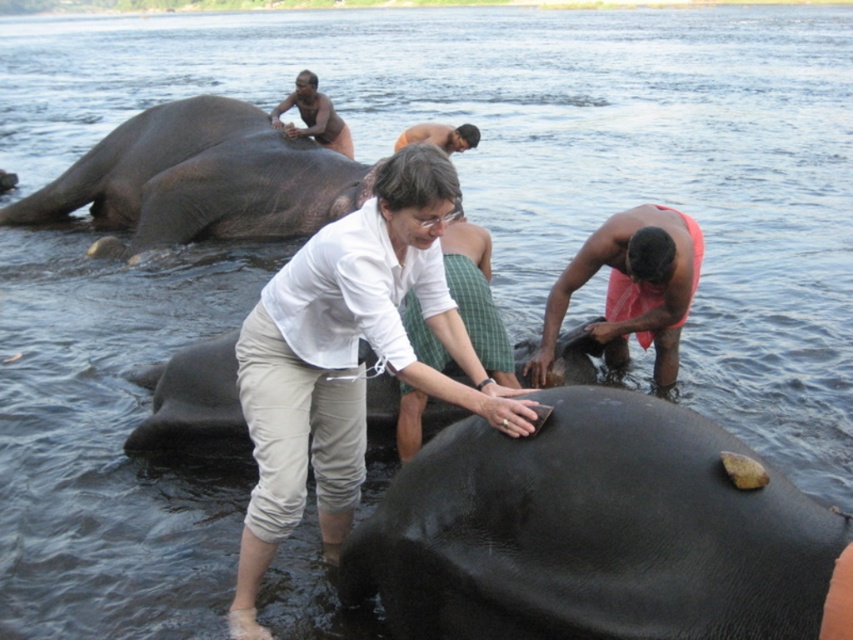
Between gray matte elephant at upper left and brown skin man at upper center, which one has more height?

With more height is gray matte elephant at upper left.

Is gray matte elephant at upper left bigger than brown skin man at upper center?

Indeed, gray matte elephant at upper left has a larger size compared to brown skin man at upper center.

Identify the location of gray matte elephant at upper left. The height and width of the screenshot is (640, 853). (198, 179).

Is point (281, 445) more distant than point (479, 138)?

No, it is in front of (479, 138).

Which is above, smooth red cloth at center or smooth skin man at upper center?

smooth skin man at upper center is higher up.

Who is more forward, (396, 244) or (447, 125)?

Point (396, 244)

Locate an element on the screen. The image size is (853, 640). smooth red cloth at center is located at coordinates (347, 358).

Is gray matte elephant at upper left wider than orange cloth towel at lower right?

Yes.

Consider the image. Can you confirm if gray matte elephant at upper left is positioned below orange cloth towel at lower right?

Actually, gray matte elephant at upper left is above orange cloth towel at lower right.

You are a GUI agent. You are given a task and a screenshot of the screen. Output one action in this format:
    pyautogui.click(x=<x>, y=<y>)
    Task: Click on the gray matte elephant at upper left
    This screenshot has height=640, width=853.
    Given the screenshot: What is the action you would take?
    pyautogui.click(x=198, y=179)